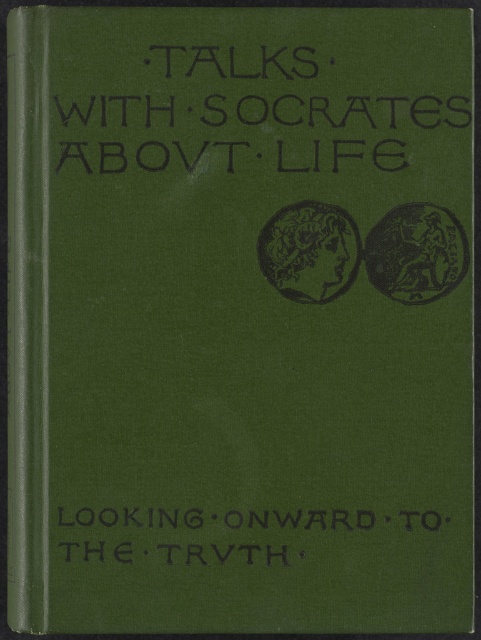
Question: Among these objects, which one is nearest to the camera?

Choices:
 (A) black textured text at upper center
 (B) black textured text at bottom

Answer: (B)

Question: Is black textured text at upper center above black textured text at bottom?

Choices:
 (A) yes
 (B) no

Answer: (A)

Question: Is black textured text at upper center in front of black textured text at bottom?

Choices:
 (A) yes
 (B) no

Answer: (B)

Question: Is black textured text at upper center bigger than black textured text at bottom?

Choices:
 (A) yes
 (B) no

Answer: (A)